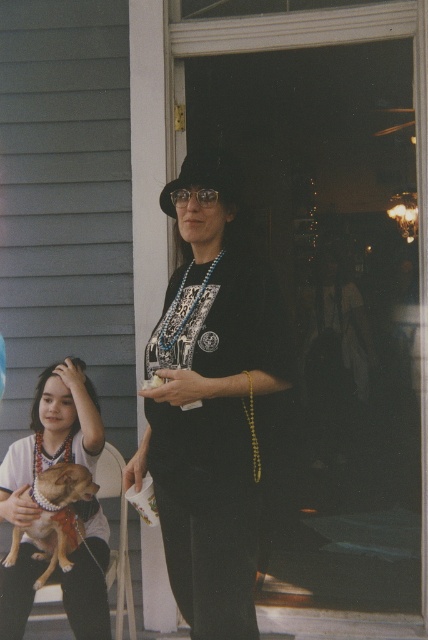
You are a fashion designer observing two dresses in the scene. The first is labeled as the black matte dress at center, and the second is the matte black dress at center. Which dress is closer to you?

The black matte dress at center is closer to you since it is only 21.33 inches away from the matte black dress at center.

Where is the black matte dress at center located in the image?

The black matte dress at center is located at point 0.631 in the x coordinate and 0.493 in the y coordinate.